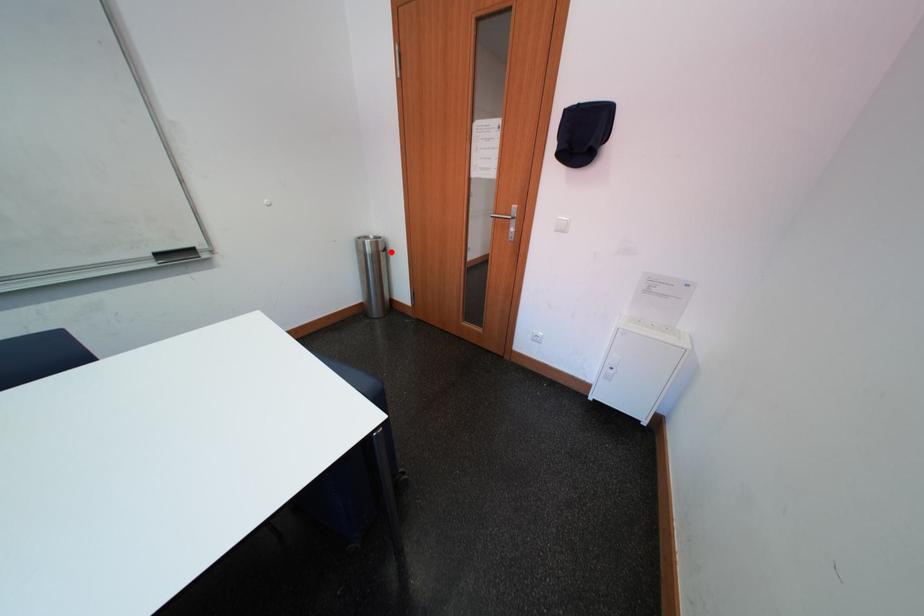
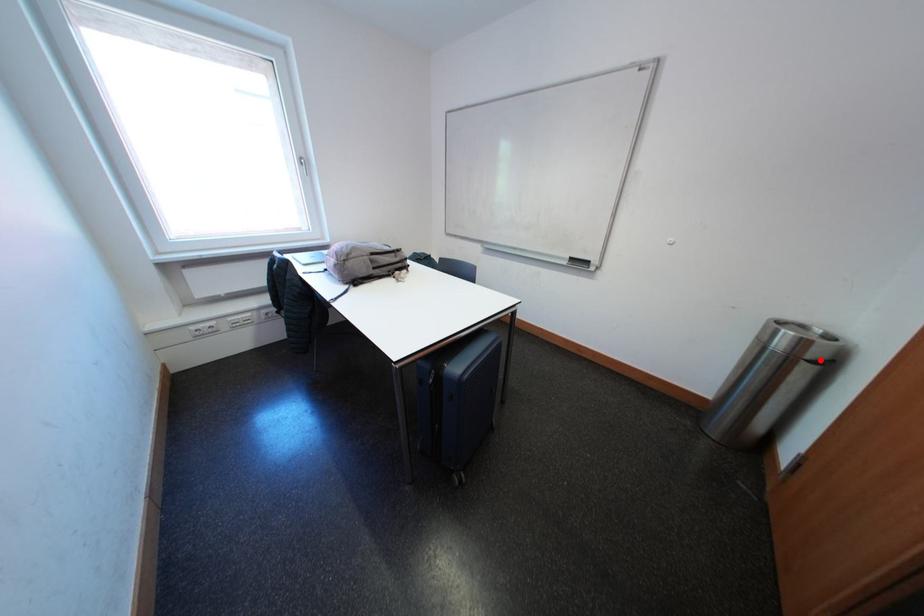
I am providing you with two images of the same scene from different viewpoints. A red point is marked on the first image and another point is marked on the second image. Is the red point in image1 aligned with the point shown in image2?

Yes